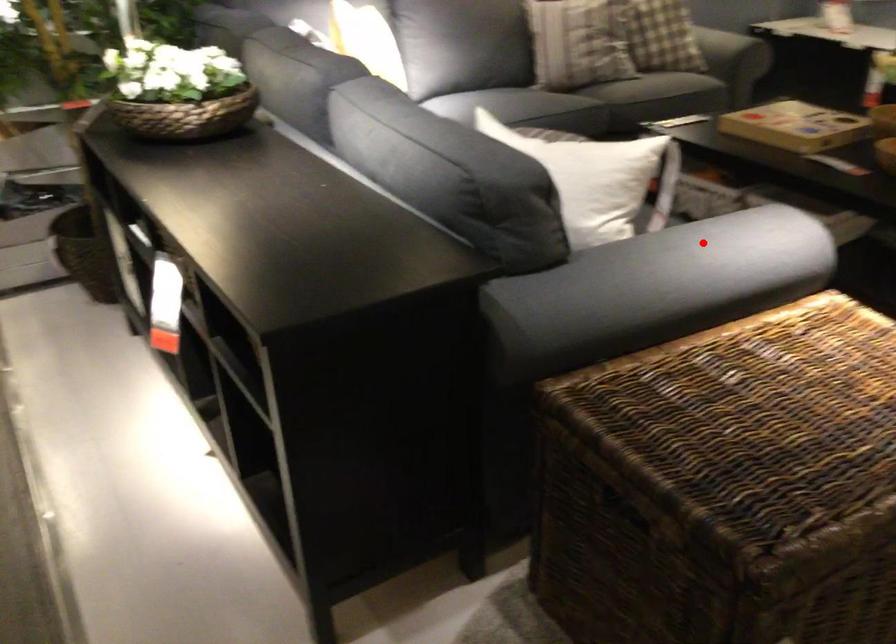
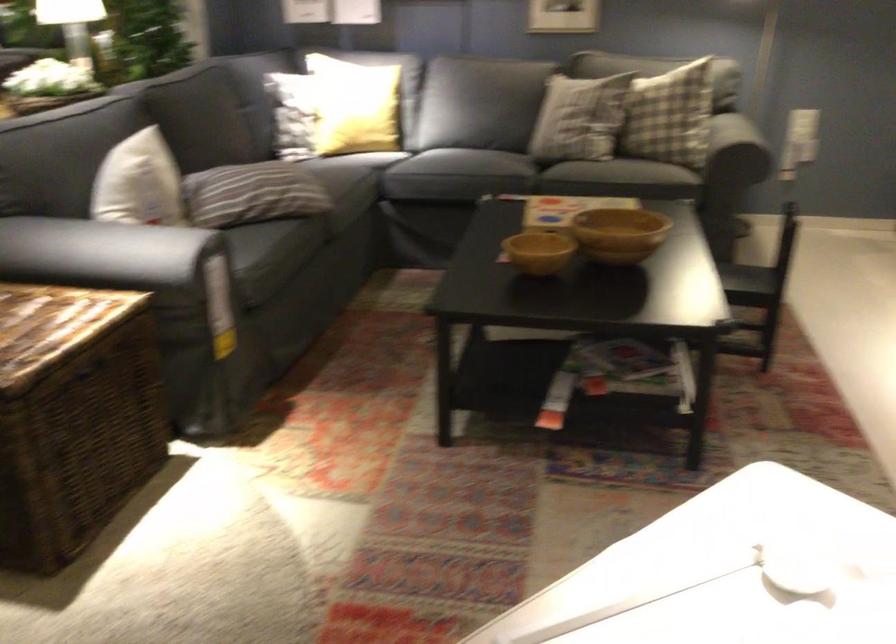
Find the pixel in the second image that matches the highlighted location in the first image.

(117, 252)